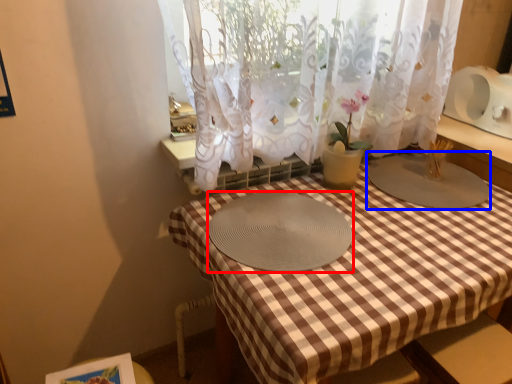
Question: Which object is further to the camera taking this photo, glass plate (highlighted by a red box) or glass plate (highlighted by a blue box)?

Choices:
 (A) glass plate
 (B) glass plate

Answer: (B)